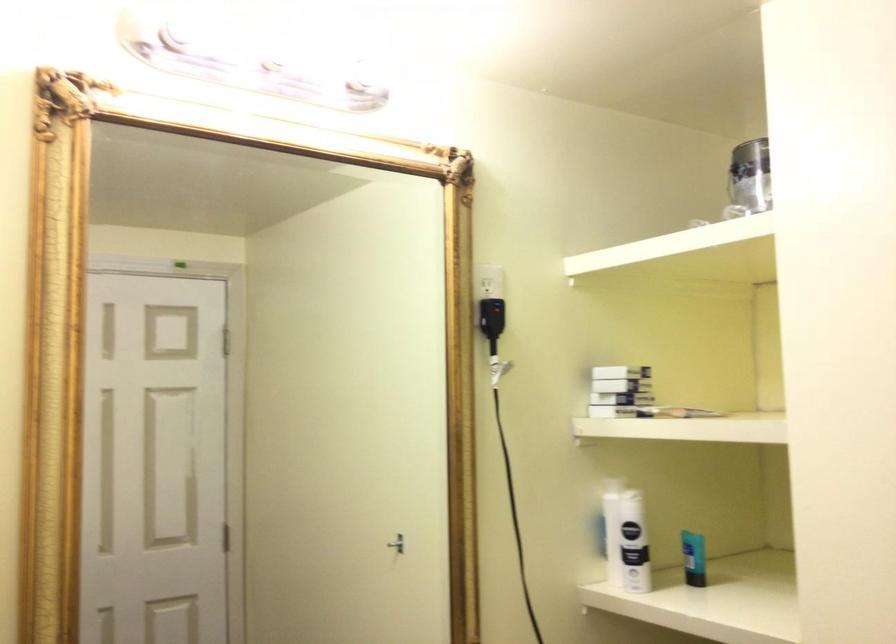
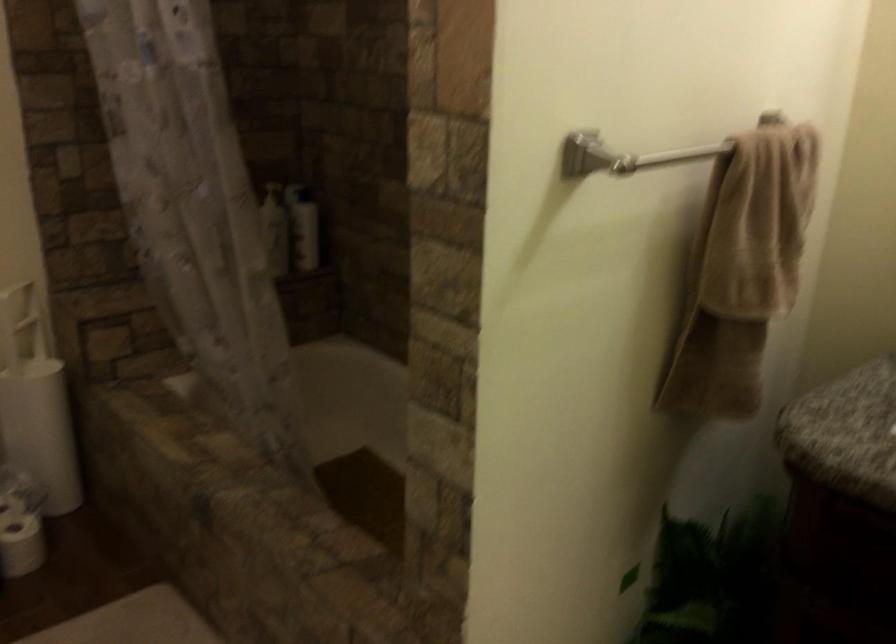
The images are taken continuously from a first-person perspective. In which direction is your viewpoint rotating?

The camera's rotation is toward left-down.